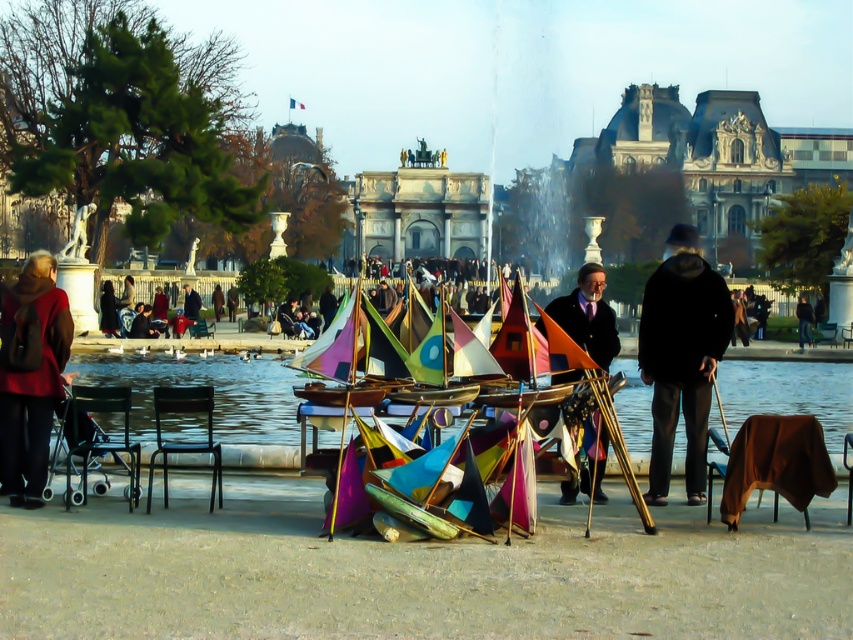
Question: Which object is positioned closest to the black fabric cane at center?

Choices:
 (A) matte black coat at center
 (B) black leather jacket at center

Answer: (A)

Question: Can you confirm if black fabric cane at center is positioned above matte black coat at center?

Choices:
 (A) yes
 (B) no

Answer: (B)

Question: Is black fabric cane at center below black leather jacket at center?

Choices:
 (A) yes
 (B) no

Answer: (A)

Question: Which point is farther to the camera?

Choices:
 (A) black leather jacket at center
 (B) matte red coat at left

Answer: (A)

Question: Considering the real-world distances, which object is closest to the black leather jacket at center?

Choices:
 (A) black fabric cane at center
 (B) matte red coat at left
 (C) matte black coat at center

Answer: (C)

Question: Is black fabric cane at center thinner than black leather jacket at center?

Choices:
 (A) yes
 (B) no

Answer: (B)